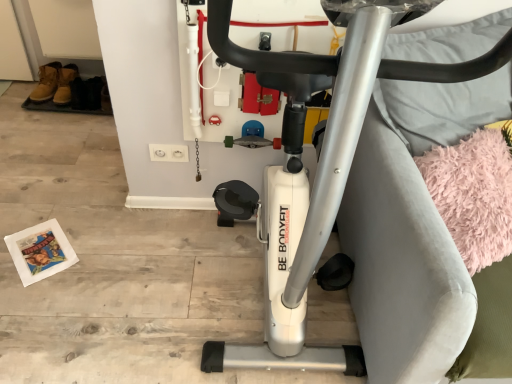
The height and width of the screenshot is (384, 512). I want to click on free space below silver metallic stationary bicycle at center (from a real-world perspective), so click(252, 284).